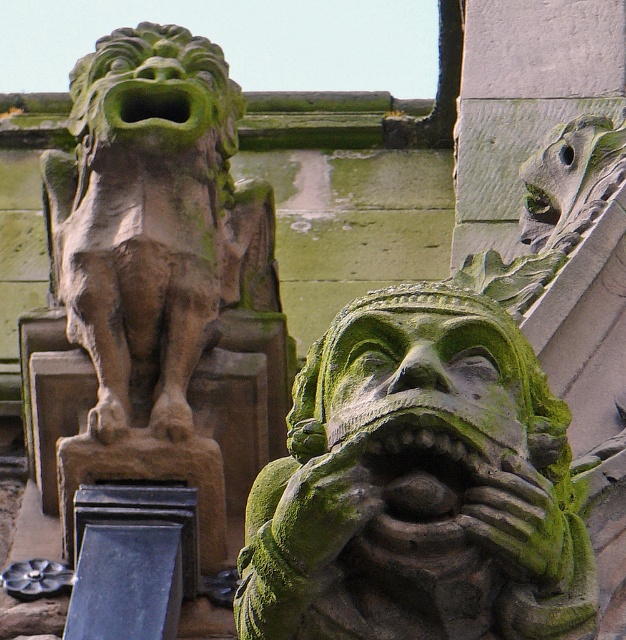
Question: Is green mossy stone lion at center smaller than green mossy stone face at center?

Choices:
 (A) no
 (B) yes

Answer: (A)

Question: Among these points, which one is farthest from the camera?

Choices:
 (A) (480, 371)
 (B) (346, 467)

Answer: (A)

Question: Can you confirm if green mossy stone lion at center is wider than green mossy stone face at center?

Choices:
 (A) yes
 (B) no

Answer: (A)

Question: Which point appears farthest from the camera in this image?

Choices:
 (A) [x=292, y=502]
 (B) [x=401, y=451]

Answer: (B)

Question: Is green mossy stone lion at center below green mossy stone face at center?

Choices:
 (A) yes
 (B) no

Answer: (B)

Question: Among these points, which one is farthest from the camera?

Choices:
 (A) (478, 454)
 (B) (332, 570)

Answer: (B)